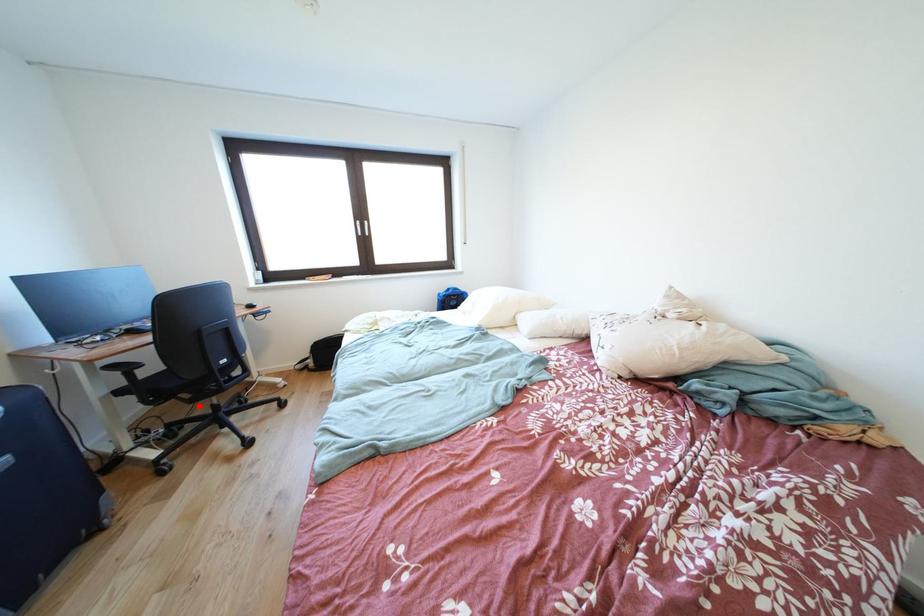
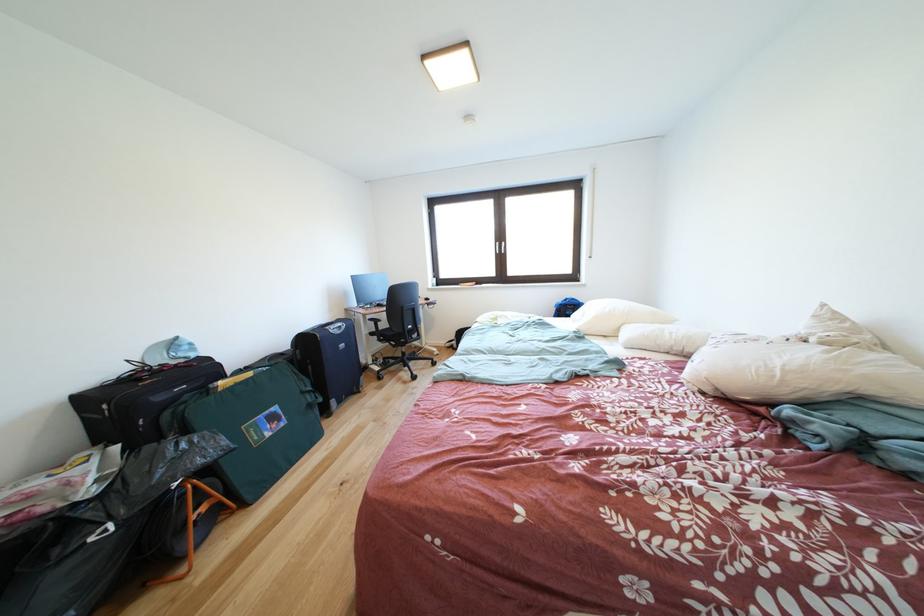
Question: I am providing you with two images of the same scene from different viewpoints. Given a red point in image1, look at the same physical point in image2. Is it:

Choices:
 (A) Closer to the viewpoint
 (B) Farther from the viewpoint

Answer: (B)